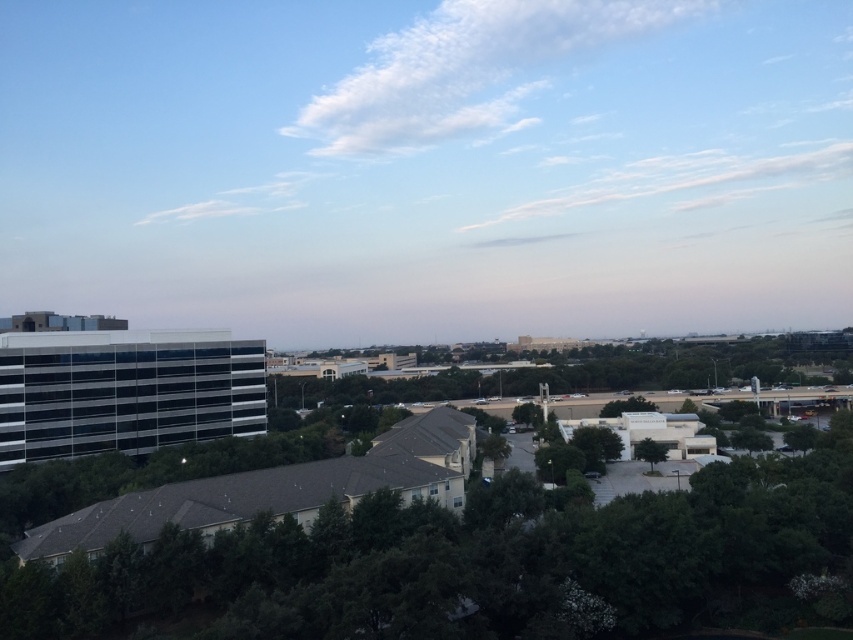
Can you confirm if green leafy tree at center is shorter than green leafy tree at center-right?

In fact, green leafy tree at center may be taller than green leafy tree at center-right.

Is green leafy tree at center bigger than green leafy tree at center-right?

Correct, green leafy tree at center is larger in size than green leafy tree at center-right.

Who is more distant from viewer, (486, 570) or (654, 456)?

Positioned behind is point (654, 456).

Where is `green leafy tree at center`? This screenshot has height=640, width=853. green leafy tree at center is located at coordinates (473, 561).